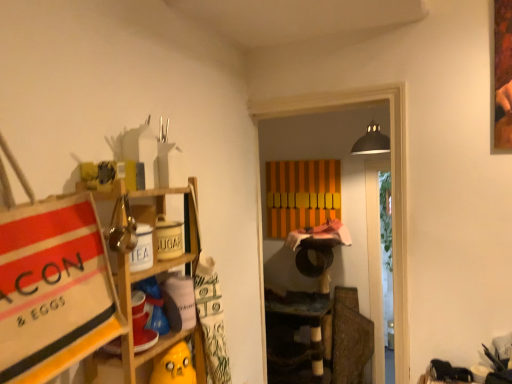
Question: In the image, is wooden shelf at left on the left side or the right side of orange striped cabinet at center?

Choices:
 (A) left
 (B) right

Answer: (A)

Question: Does point (146, 354) appear closer or farther from the camera than point (326, 165)?

Choices:
 (A) closer
 (B) farther

Answer: (A)

Question: Considering the positions of wooden shelf at left and orange striped cabinet at center in the image, is wooden shelf at left wider or thinner than orange striped cabinet at center?

Choices:
 (A) wide
 (B) thin

Answer: (A)

Question: Relative to wooden shelf at left, is orange striped cabinet at center in front or behind?

Choices:
 (A) front
 (B) behind

Answer: (B)

Question: Does point (308, 198) appear closer or farther from the camera than point (102, 193)?

Choices:
 (A) farther
 (B) closer

Answer: (A)

Question: Looking at their shapes, would you say orange striped cabinet at center is wider or thinner than wooden shelf at left?

Choices:
 (A) thin
 (B) wide

Answer: (A)

Question: In the image, is orange striped cabinet at center on the left side or the right side of wooden shelf at left?

Choices:
 (A) right
 (B) left

Answer: (A)